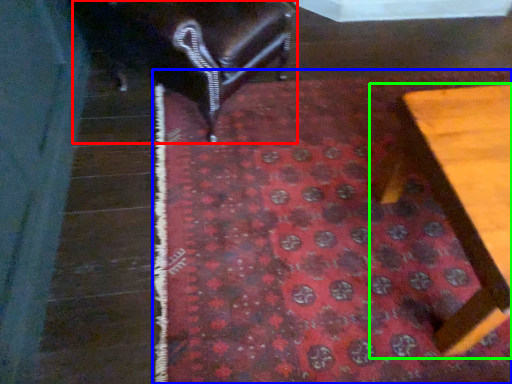
Question: Which object is positioned farthest from furniture (highlighted by a red box)? Select from mat (highlighted by a blue box) and furniture (highlighted by a green box).

Choices:
 (A) mat
 (B) furniture

Answer: (B)